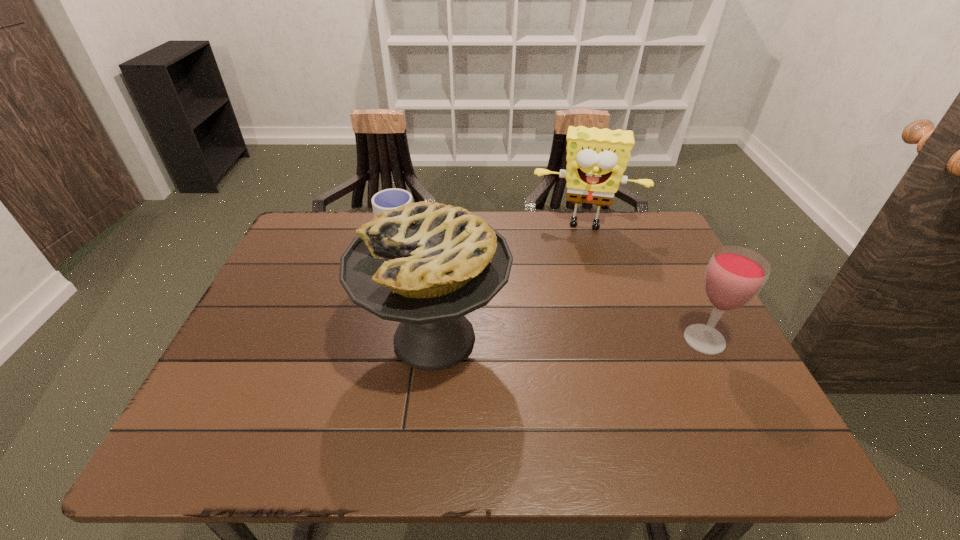
This screenshot has width=960, height=540. What are the coordinates of `free region at the far edge` in the screenshot? It's located at (561, 241).

The width and height of the screenshot is (960, 540). I want to click on vacant space at the near edge, so click(365, 390).

This screenshot has height=540, width=960. In the image, there is a desktop. Find the location of `free space at the left edge`. free space at the left edge is located at coordinates (314, 319).

The image size is (960, 540). I want to click on vacant space at the right edge, so click(x=658, y=284).

In the image, there is a desktop. In order to click on free space at the far left corner in this screenshot , I will do `click(295, 238)`.

Where is `vacant space at the near left corner of the desktop`? Image resolution: width=960 pixels, height=540 pixels. vacant space at the near left corner of the desktop is located at coordinates (230, 400).

The image size is (960, 540). What are the coordinates of `free space at the far right corner` in the screenshot? It's located at (615, 222).

Where is `vacant space at the near right corner of the desktop`? This screenshot has height=540, width=960. vacant space at the near right corner of the desktop is located at coordinates (743, 406).

This screenshot has width=960, height=540. I want to click on vacant point located between the sponge and the third tallest object, so click(645, 282).

Find the location of a particular element. vacant area that lies between the sponge and the wineglass is located at coordinates (645, 282).